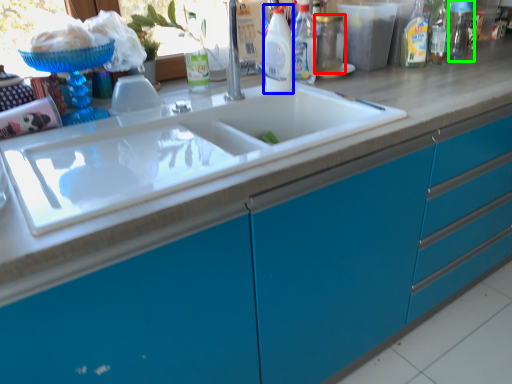
Question: Estimate the real-world distances between objects in this image. Which object is closer to bottle (highlighted by a red box), bottle (highlighted by a blue box) or bottle (highlighted by a green box)?

Choices:
 (A) bottle
 (B) bottle

Answer: (A)